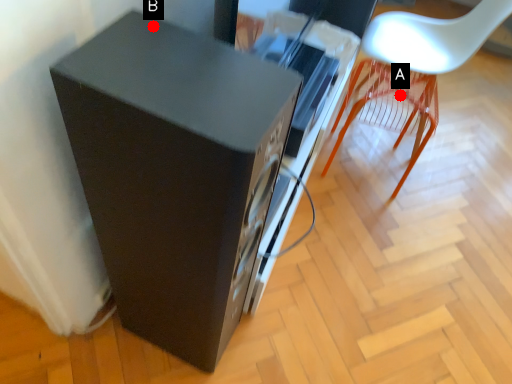
Question: Two points are circled on the image, labeled by A and B beside each circle. Among these points, which one is farthest from the camera?

Choices:
 (A) A is further
 (B) B is further

Answer: (A)